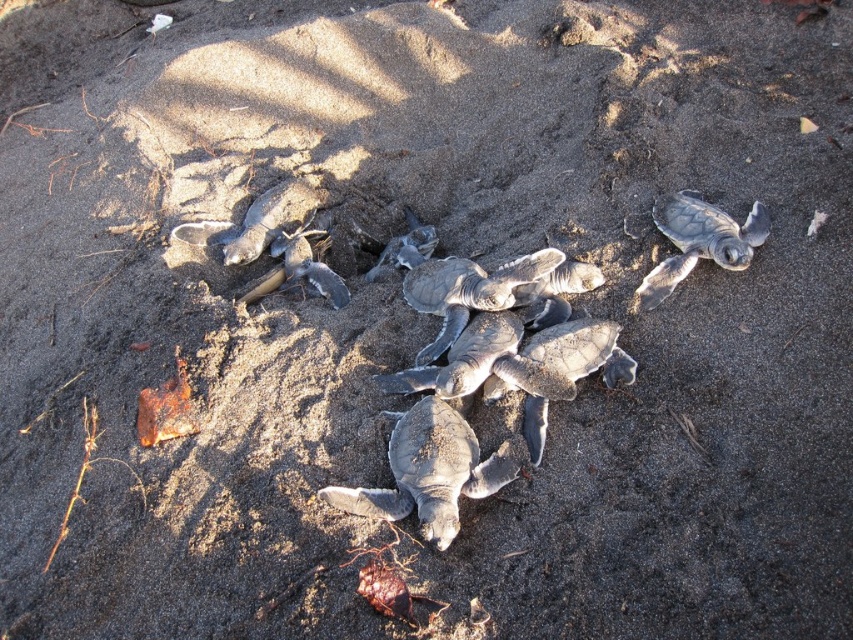
Does gray matte turtle at center have a greater height compared to gray matte turtle at upper right?

In fact, gray matte turtle at center may be shorter than gray matte turtle at upper right.

Can you confirm if gray matte turtle at center is positioned above gray matte turtle at upper right?

Actually, gray matte turtle at center is below gray matte turtle at upper right.

Is point (432, 436) less distant than point (693, 241)?

Yes, point (432, 436) is in front of point (693, 241).

This screenshot has width=853, height=640. I want to click on gray matte turtle at center, so click(x=431, y=472).

Can you confirm if gray matte turtles at center is positioned to the left of gray matte turtle at center?

No, gray matte turtles at center is not to the left of gray matte turtle at center.

Find the location of a particular element. The image size is (853, 640). gray matte turtles at center is located at coordinates (468, 300).

This screenshot has width=853, height=640. What do you see at coordinates (468, 300) in the screenshot?
I see `gray matte turtles at center` at bounding box center [468, 300].

Locate an element on the screen. This screenshot has width=853, height=640. gray matte turtles at center is located at coordinates (468, 300).

Is gray matte turtles at center behind gray matte turtle at upper right?

No, gray matte turtles at center is in front of gray matte turtle at upper right.

This screenshot has height=640, width=853. I want to click on gray matte turtles at center, so click(x=468, y=300).